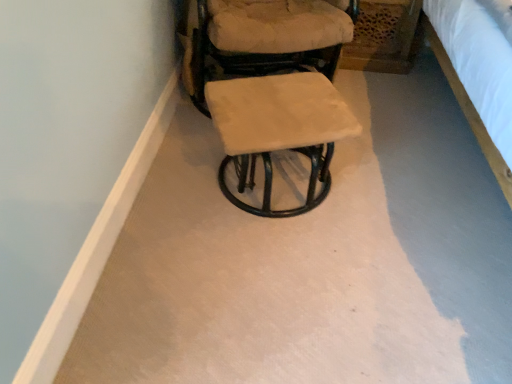
Where is `white fabric chair at center`? white fabric chair at center is located at coordinates (270, 86).

Describe the element at coordinates (270, 86) in the screenshot. This screenshot has width=512, height=384. I see `white fabric chair at center` at that location.

This screenshot has width=512, height=384. I want to click on white fabric chair at center, so click(270, 86).